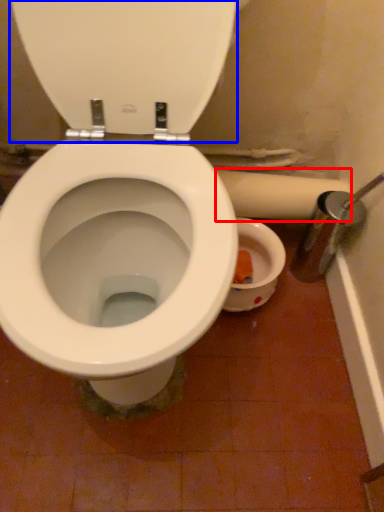
Question: Which object is closer to the camera taking this photo, toilet paper (highlighted by a red box) or back (highlighted by a blue box)?

Choices:
 (A) toilet paper
 (B) back

Answer: (B)